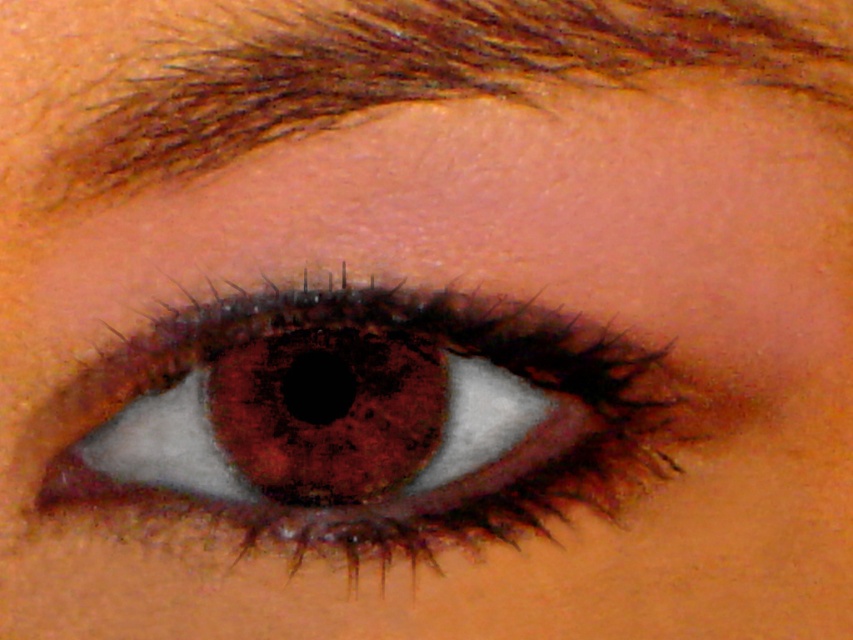
Question: Does brown matte eye at center have a lesser width compared to brown hair at upper center?

Choices:
 (A) no
 (B) yes

Answer: (B)

Question: Where is brown matte eye at center located in relation to brown hair at upper center in the image?

Choices:
 (A) below
 (B) above

Answer: (A)

Question: Is brown matte eye at center further to the viewer compared to brown hair at upper center?

Choices:
 (A) yes
 (B) no

Answer: (A)